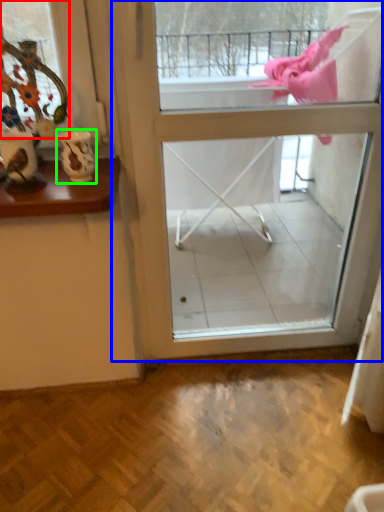
Question: Which object is the farthest from window (highlighted by a red box)? Choose among these: screen door (highlighted by a blue box) or vase (highlighted by a green box).

Choices:
 (A) screen door
 (B) vase

Answer: (A)